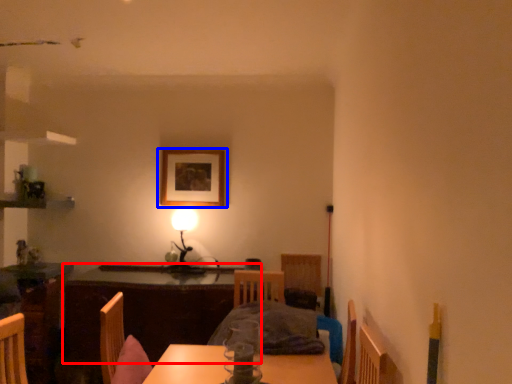
Question: Which object appears closest to the camera in this image, table (highlighted by a red box) or picture frame (highlighted by a blue box)?

Choices:
 (A) table
 (B) picture frame

Answer: (A)